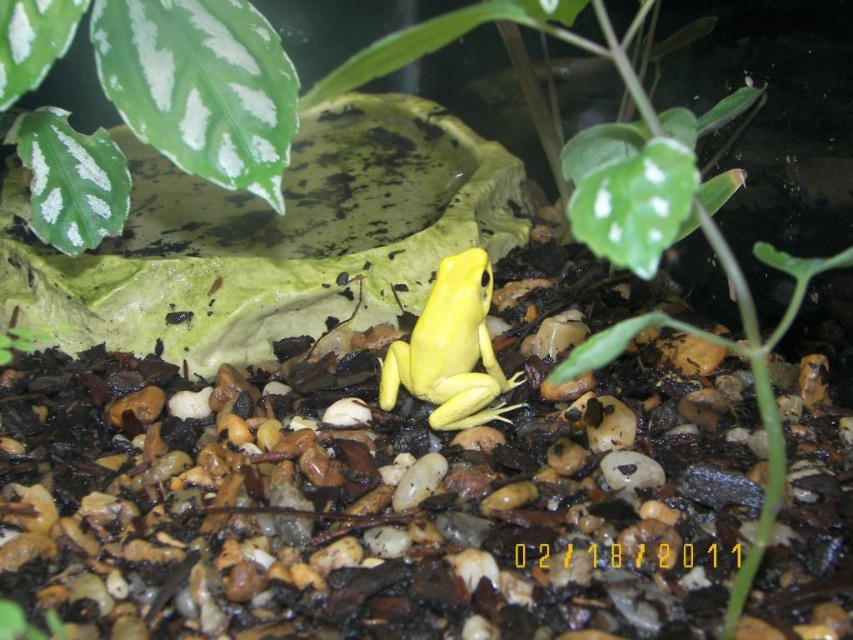
Does white matte leaf at upper left appear on the right side of yellow matte/skinny frog at center?

Incorrect, white matte leaf at upper left is not on the right side of yellow matte/skinny frog at center.

The image size is (853, 640). Describe the element at coordinates (172, 77) in the screenshot. I see `white matte leaf at upper left` at that location.

Does point (192, 33) lie behind point (412, 378)?

That is False.

You are a GUI agent. You are given a task and a screenshot of the screen. Output one action in this format:
    pyautogui.click(x=<x>, y=<y>)
    Task: Click on the white matte leaf at upper left
    This screenshot has height=640, width=853.
    Given the screenshot: What is the action you would take?
    pyautogui.click(x=172, y=77)